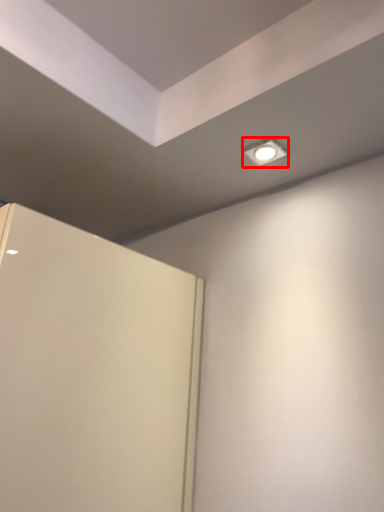
Question: Where is lighting (annotated by the red box) located in relation to door in the image?

Choices:
 (A) left
 (B) right

Answer: (B)